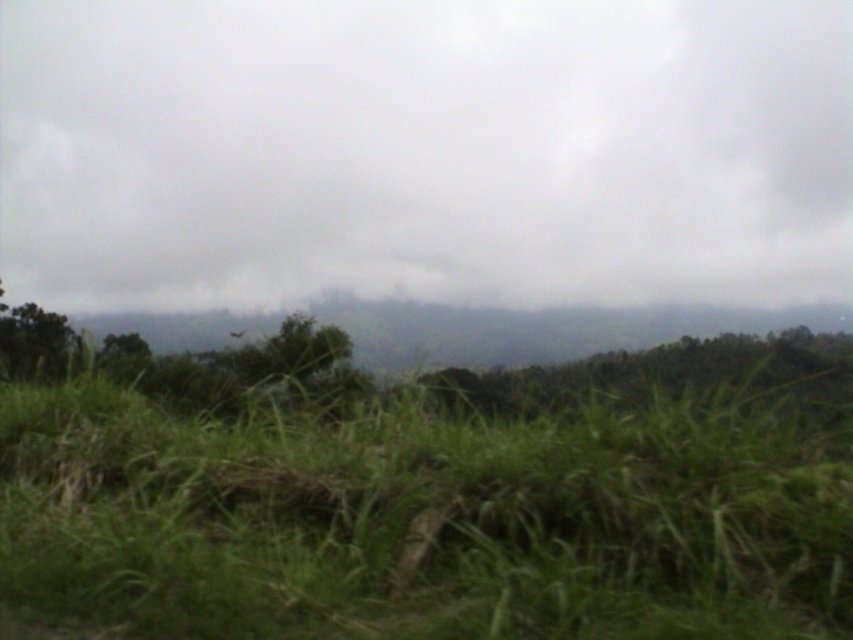
Question: Which object is the closest to the green grassy field at lower center?

Choices:
 (A) gray cloudy sky at upper center
 (B) green leafy tree at center

Answer: (B)

Question: Among these objects, which one is nearest to the camera?

Choices:
 (A) green leafy tree at center
 (B) green grassy field at lower center

Answer: (B)

Question: Which point is farther from the camera taking this photo?

Choices:
 (A) (13, 536)
 (B) (310, 65)

Answer: (B)

Question: Can you confirm if green grassy field at lower center is smaller than green leafy tree at center?

Choices:
 (A) no
 (B) yes

Answer: (B)

Question: Is gray cloudy sky at upper center positioned at the back of green leafy tree at center?

Choices:
 (A) no
 (B) yes

Answer: (B)

Question: Is green grassy field at lower center closer to the viewer compared to green leafy tree at center?

Choices:
 (A) no
 (B) yes

Answer: (B)